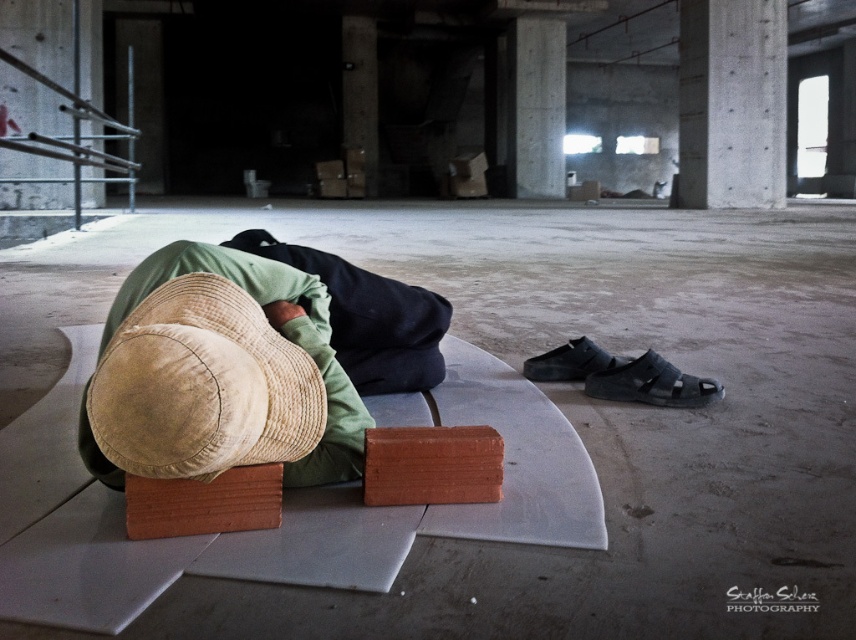
You are an architect designing a new building and need to place a tan straw hat at center and a concrete at upper right. Given their sizes, which object will require more space horizontally?

The concrete at upper right requires more horizontal space since it has a greater width than the tan straw hat at center.